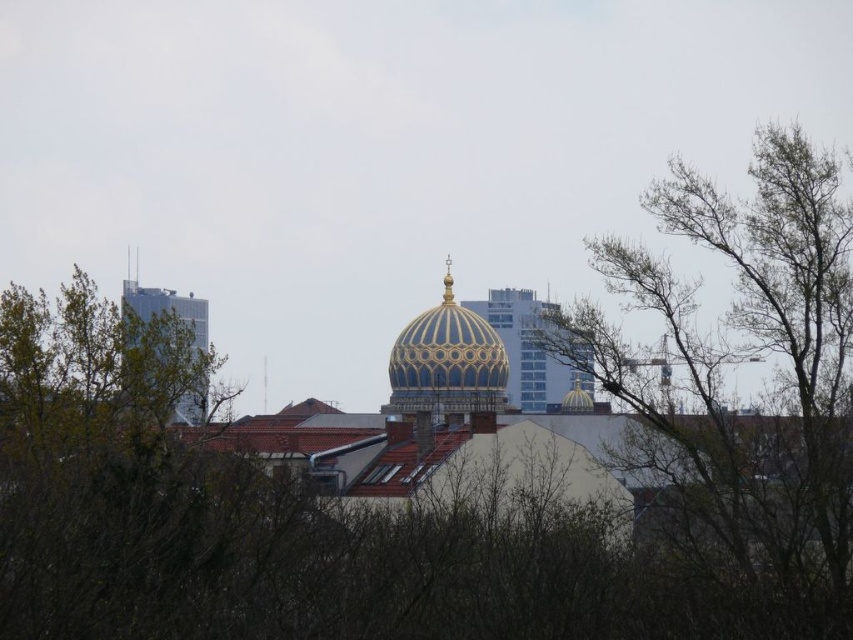
You are a city planner evaluating the skyline. You need to determine if the gold metallic dome at center would block the view of the glassy silver skyscraper at left from a vantage point directly behind the dome. Based on their heights, what would you conclude?

The gold metallic dome at center is taller than the glassy silver skyscraper at left. Therefore, the dome would block the view of the skyscraper from a vantage point directly behind it.

You are a photographer trying to capture the gold metallic dome at center without any obstructions. You notice the bare branches at upper right in your viewfinder. Can you adjust your position to avoid the branches while still keeping the dome in the frame?

The bare branches at upper right is in front of gold metallic dome at center, so moving the camera position to the left or right might allow you to reposition the branches out of the frame while keeping the dome visible.

You are standing at the point with coordinates point (x=202, y=317) and want to walk to the point with coordinates point (x=838, y=509). Given the cityscape scene described, will the dome with intricate blue and gold patterns block your path?

Point (x=838, y=509) is in front of point (x=202, y=317), so the dome with intricate blue and gold patterns would not block your path since you are moving towards the point in front.